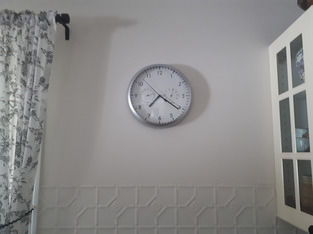
You are a GUI agent. You are given a task and a screenshot of the screen. Output one action in this format:
    pyautogui.click(x=<x>, y=<y>)
    Task: Click on the hour hand on the clock
    Image resolution: width=313 pixels, height=234 pixels.
    Given the screenshot: What is the action you would take?
    pyautogui.click(x=150, y=102)